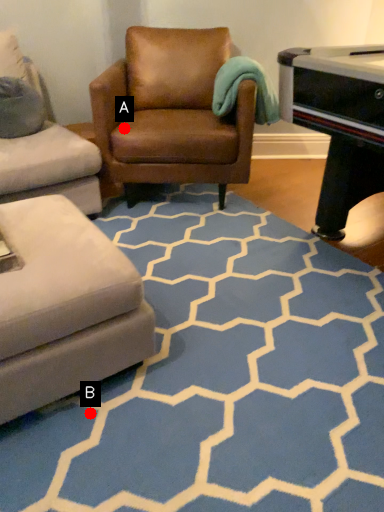
Question: Two points are circled on the image, labeled by A and B beside each circle. Which point appears farthest from the camera in this image?

Choices:
 (A) A is further
 (B) B is further

Answer: (A)